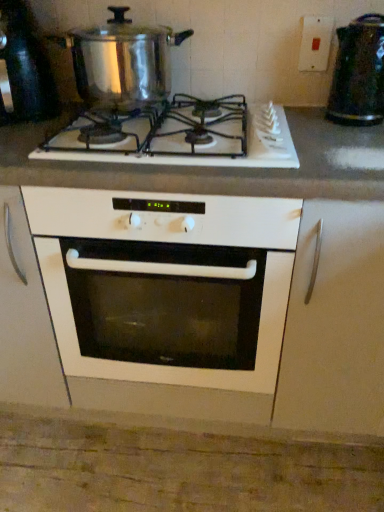
Where is `space that is in front of metallic textured kettle at upper right, the first appliance viewed from the right`? space that is in front of metallic textured kettle at upper right, the first appliance viewed from the right is located at coordinates (349, 137).